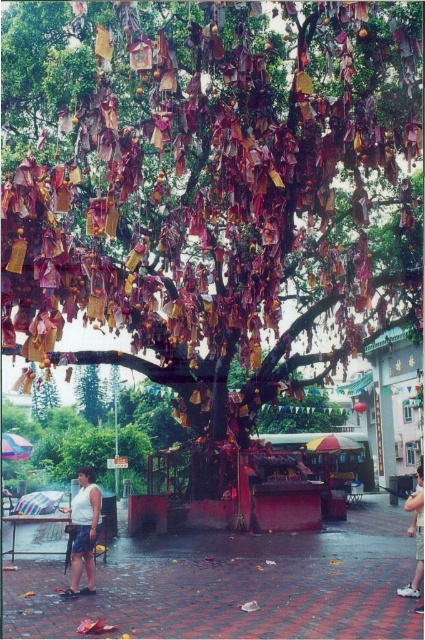
Question: Is white matte tank top at lower center closer to the viewer compared to skinny jeans at lower right?

Choices:
 (A) yes
 (B) no

Answer: (B)

Question: In this image, where is white matte tank top at lower center located relative to skinny jeans at lower right?

Choices:
 (A) above
 (B) below

Answer: (A)

Question: Where is white matte tank top at lower center located in relation to skinny jeans at lower right in the image?

Choices:
 (A) left
 (B) right

Answer: (A)

Question: Among these points, which one is nearest to the camera?

Choices:
 (A) (87, 547)
 (B) (422, 534)

Answer: (B)

Question: Which of the following is the farthest from the observer?

Choices:
 (A) skinny jeans at lower right
 (B) white matte tank top at lower center

Answer: (B)